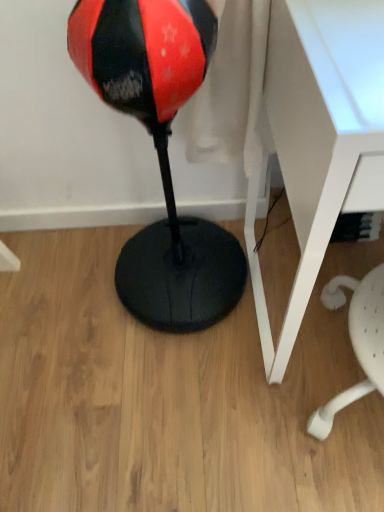
Question: Would you say red/black glossy bean bag at center is a long distance from white plastic table at right?

Choices:
 (A) no
 (B) yes

Answer: (A)

Question: From a real-world perspective, is red/black glossy bean bag at center positioned over white plastic table at right based on gravity?

Choices:
 (A) yes
 (B) no

Answer: (A)

Question: Could you tell me if red/black glossy bean bag at center is facing white plastic table at right?

Choices:
 (A) no
 (B) yes

Answer: (A)

Question: Is white plastic table at right at the back of red/black glossy bean bag at center?

Choices:
 (A) yes
 (B) no

Answer: (B)

Question: Does red/black glossy bean bag at center have a greater width compared to white plastic table at right?

Choices:
 (A) yes
 (B) no

Answer: (B)

Question: Would you say red/black glossy bean bag at center contains white plastic table at right?

Choices:
 (A) no
 (B) yes

Answer: (A)

Question: Is white plastic table at right taller than red/black glossy bean bag at center?

Choices:
 (A) yes
 (B) no

Answer: (B)

Question: Can you confirm if white plastic table at right is positioned to the left of red/black glossy bean bag at center?

Choices:
 (A) no
 (B) yes

Answer: (A)

Question: Is white plastic table at right further to camera compared to red/black glossy bean bag at center?

Choices:
 (A) no
 (B) yes

Answer: (A)

Question: Is white plastic table at right positioned with its back to red/black glossy bean bag at center?

Choices:
 (A) no
 (B) yes

Answer: (A)

Question: Can you confirm if white plastic table at right is shorter than red/black glossy bean bag at center?

Choices:
 (A) yes
 (B) no

Answer: (A)

Question: From the image's perspective, is white plastic table at right located beneath red/black glossy bean bag at center?

Choices:
 (A) no
 (B) yes

Answer: (B)

Question: Would you say red/black glossy bean bag at center is inside or outside white plastic table at right?

Choices:
 (A) outside
 (B) inside

Answer: (A)